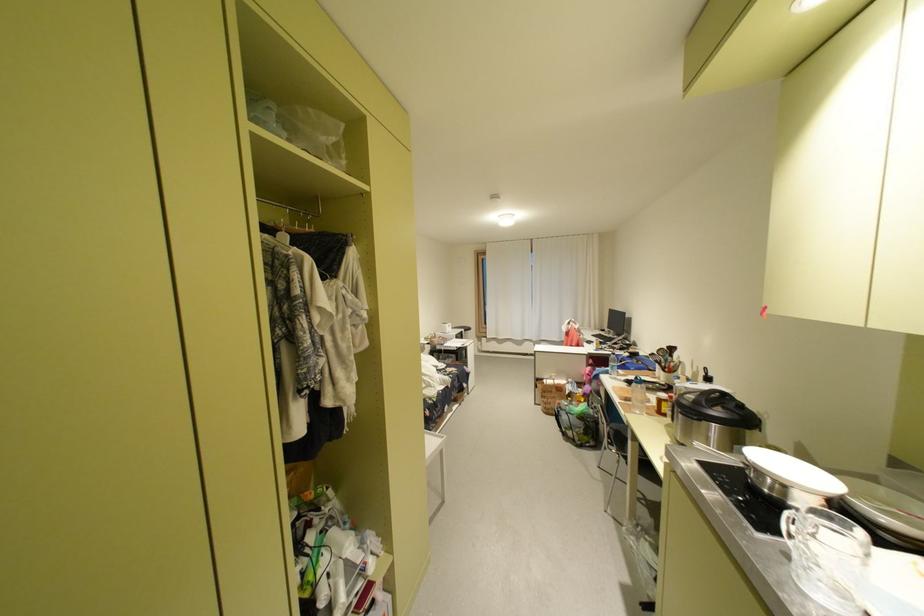
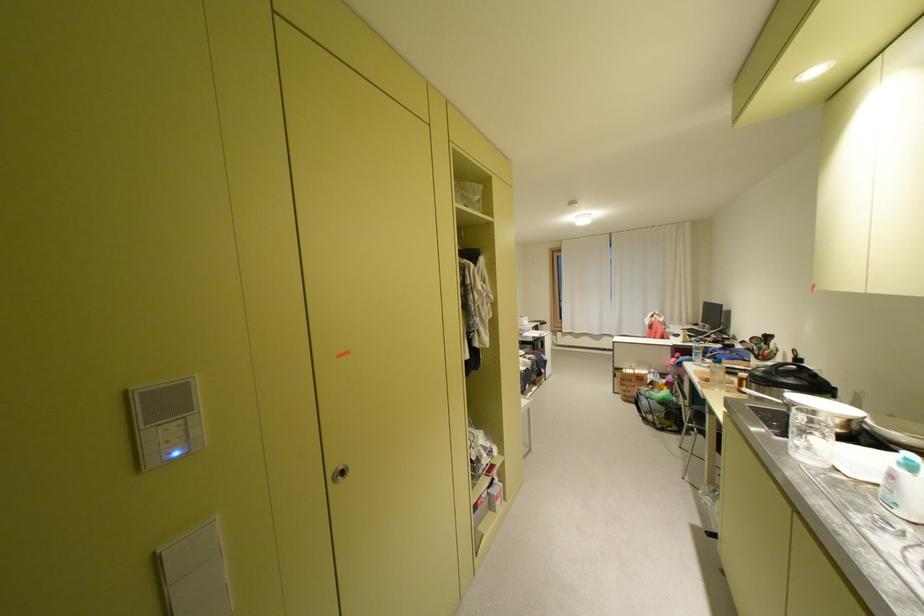
Question: The camera is either moving clockwise (left) or counter-clockwise (right) around the object. The first image is from the beginning of the video and the second image is from the end. Is the camera moving left or right when shooting the video?

Choices:
 (A) Left
 (B) Right

Answer: (B)